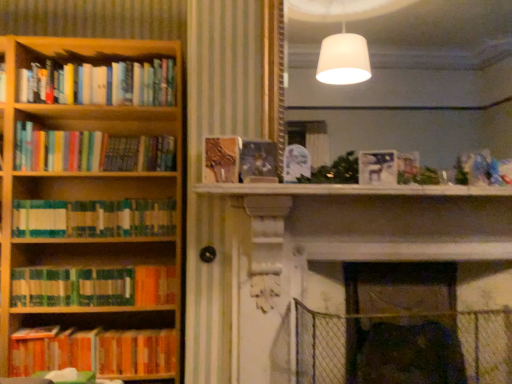
Question: Is hardcover books at left, which ranks as the 6th book in bottom-to-top order, surrounded by velvet dark brown swivel chair at lower right?

Choices:
 (A) no
 (B) yes

Answer: (A)

Question: From the image's perspective, is velvet dark brown swivel chair at lower right under hardcover books at left, which is the 1th book in top-to-bottom order?

Choices:
 (A) no
 (B) yes

Answer: (B)

Question: From a real-world perspective, is velvet dark brown swivel chair at lower right on hardcover books at left, which ranks as the 6th book in bottom-to-top order?

Choices:
 (A) yes
 (B) no

Answer: (B)

Question: Does velvet dark brown swivel chair at lower right lie behind hardcover books at left, which is the 1th book in top-to-bottom order?

Choices:
 (A) no
 (B) yes

Answer: (A)

Question: Can you confirm if velvet dark brown swivel chair at lower right is thinner than hardcover books at left, which ranks as the 6th book in bottom-to-top order?

Choices:
 (A) yes
 (B) no

Answer: (B)

Question: In terms of height, does green matte bookshelf at left, the 2th book ordered from the bottom, look taller or shorter compared to wooden bookcase at left?

Choices:
 (A) tall
 (B) short

Answer: (B)

Question: From a real-world perspective, is green matte bookshelf at left, the 2th book ordered from the bottom, above or below wooden bookcase at left?

Choices:
 (A) above
 (B) below

Answer: (B)

Question: In terms of size, does green matte bookshelf at left, the 2th book ordered from the bottom, appear bigger or smaller than wooden bookcase at left?

Choices:
 (A) small
 (B) big

Answer: (A)

Question: Is green matte bookshelf at left, positioned as the 5th book in top-to-bottom order, inside or outside of wooden bookcase at left?

Choices:
 (A) outside
 (B) inside

Answer: (B)

Question: Considering the positions of white matte paper at upper center and green matte bookshelf at left, which is the 4th book in top-to-bottom order, in the image, is white matte paper at upper center taller or shorter than green matte bookshelf at left, which is the 4th book in top-to-bottom order,?

Choices:
 (A) short
 (B) tall

Answer: (A)

Question: From the image's perspective, is white matte paper at upper center located above or below green matte bookshelf at left, which is the 4th book in top-to-bottom order?

Choices:
 (A) below
 (B) above

Answer: (B)

Question: Is white matte paper at upper center wider or thinner than green matte bookshelf at left, the 3th book ordered from the bottom?

Choices:
 (A) thin
 (B) wide

Answer: (A)

Question: Looking at the image, does white matte paper at upper center seem bigger or smaller compared to green matte bookshelf at left, the 3th book ordered from the bottom?

Choices:
 (A) big
 (B) small

Answer: (B)

Question: Is green matte bookshelf at left, the 3th book ordered from the bottom, to the left or to the right of orange matte bookshelf at lower left, the first book in the bottom-to-top sequence, in the image?

Choices:
 (A) left
 (B) right

Answer: (B)

Question: Is point (60, 200) positioned closer to the camera than point (110, 344)?

Choices:
 (A) farther
 (B) closer

Answer: (A)